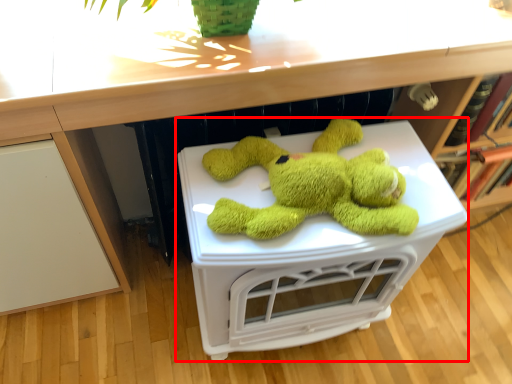
Question: From the image's perspective, considering the relative positions of table (annotated by the red box) and counter top in the image provided, where is table (annotated by the red box) located with respect to the staircase?

Choices:
 (A) below
 (B) above

Answer: (A)